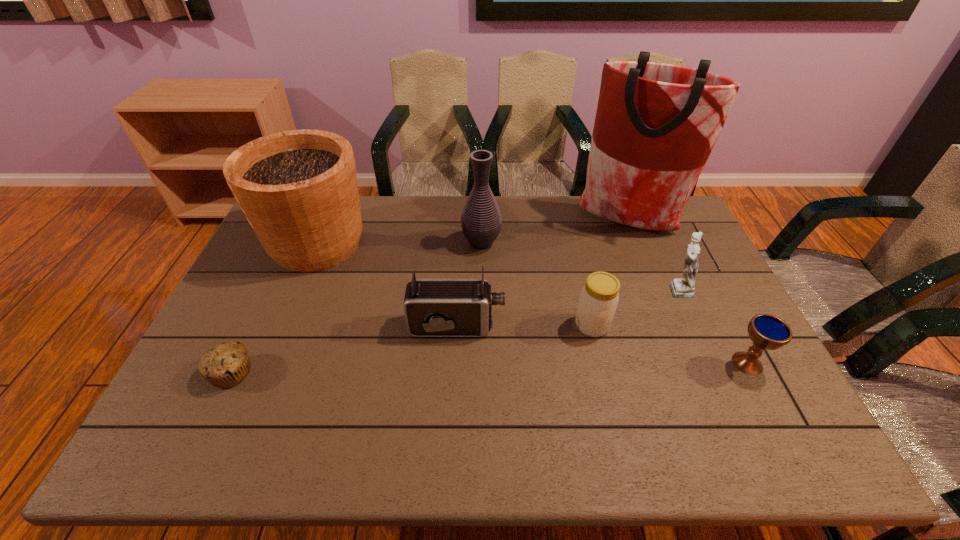
The image size is (960, 540). I want to click on the seventh closest object to the camcorder, so click(766, 331).

Where is `object that is the second closest to the flowerpot`? Image resolution: width=960 pixels, height=540 pixels. object that is the second closest to the flowerpot is located at coordinates (227, 364).

You are a GUI agent. You are given a task and a screenshot of the screen. Output one action in this format:
    pyautogui.click(x=<x>, y=<y>)
    Task: Click on the vacant area in the image that satisfies the following two spatial constraints: 1. on the back side of the shortest object; 2. on the right side of the jar
    Image resolution: width=960 pixels, height=540 pixels.
    Given the screenshot: What is the action you would take?
    pyautogui.click(x=254, y=326)